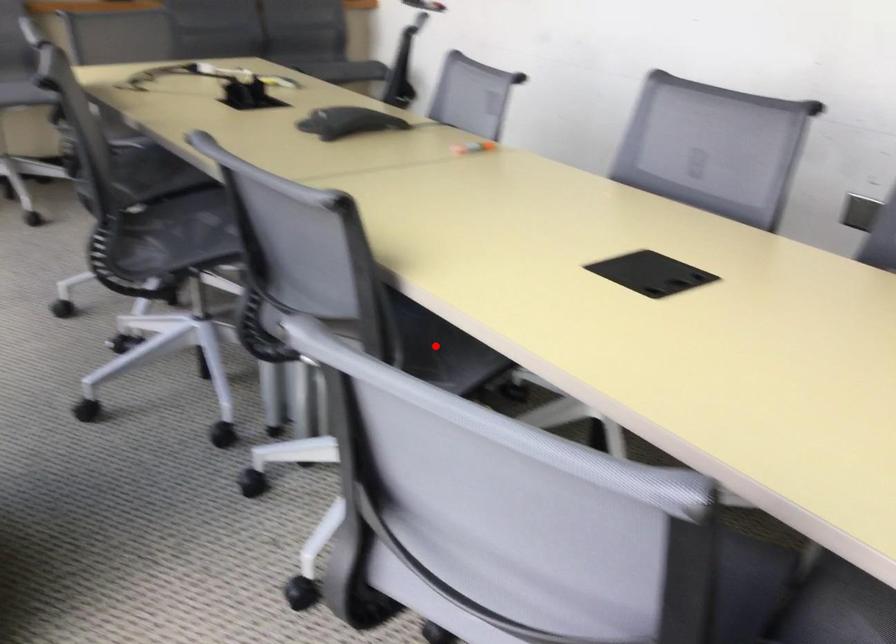
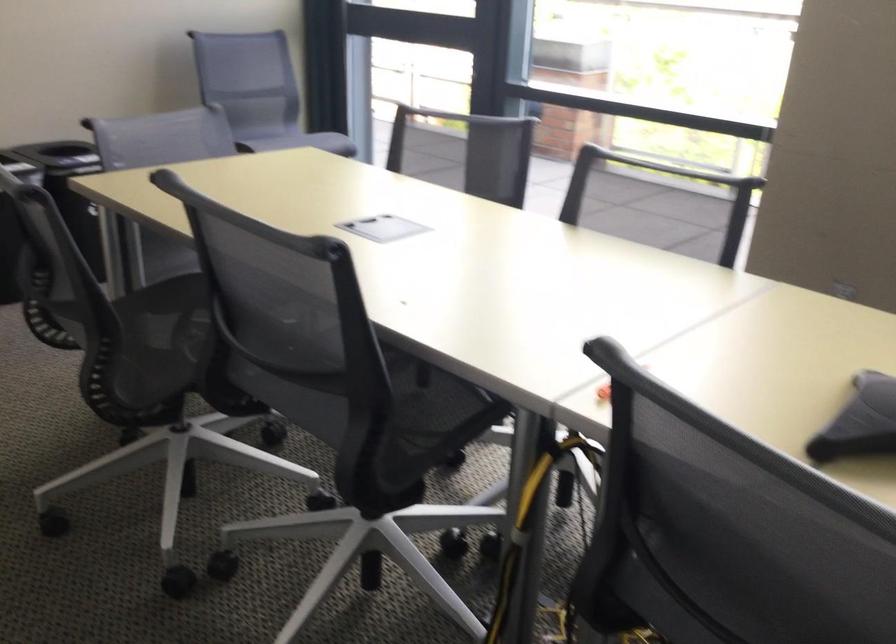
Question: I am providing you with two images of the same scene from different viewpoints. A red point is marked on the first image. At the location where the point appears in image 1, is it still visible in image 2?

Choices:
 (A) Yes
 (B) No

Answer: (B)